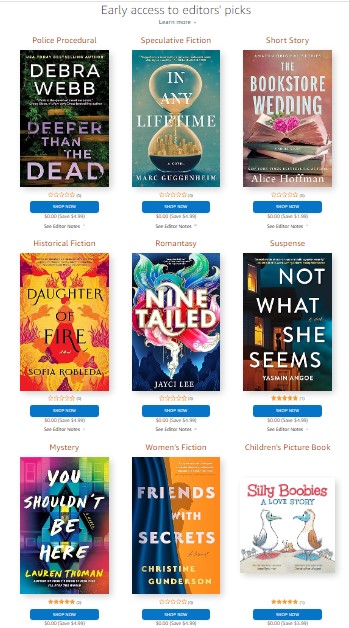
Find the location of a particular element. books is located at coordinates (284, 512), (170, 514), (65, 500), (62, 301), (165, 299), (307, 311), (277, 115), (154, 105), (30, 95).